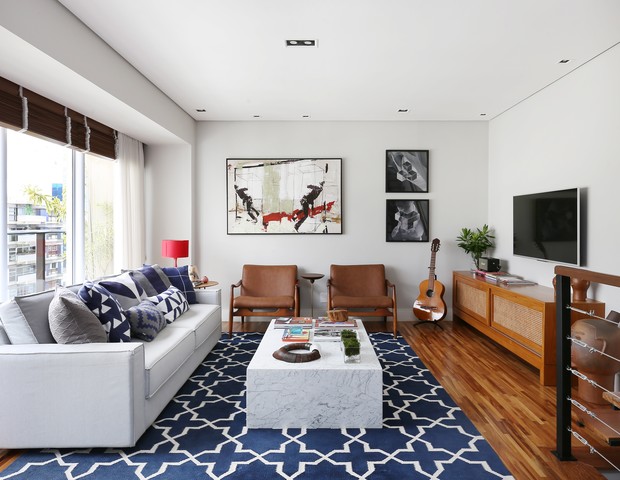
Find the location of a particular element. rug is located at coordinates (x=420, y=443).